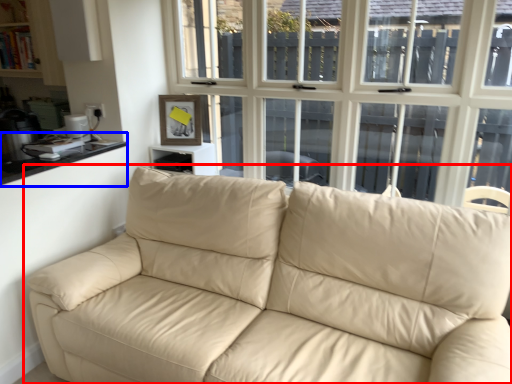
Question: Which point is closer to the camera, studio couch (highlighted by a red box) or counter top (highlighted by a blue box)?

Choices:
 (A) studio couch
 (B) counter top

Answer: (A)